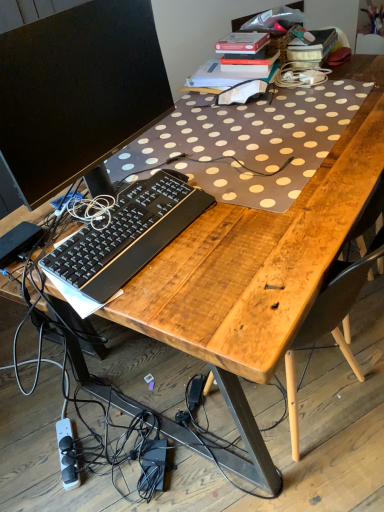
The image size is (384, 512). Identify the location of spots to the right of black matte computer monitor at upper left. (243, 182).